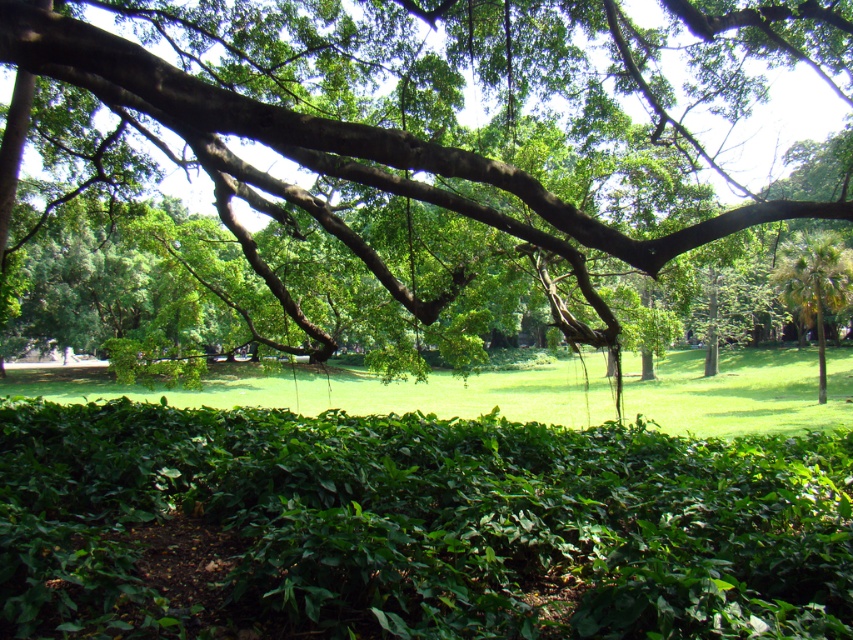
You are a gardener who needs to place a small statue between the green leafy bush at center and the green leafy palm at right. Which side of the statue should face the larger plant to ensure it gets more sunlight?

The green leafy bush at center is bigger than the green leafy palm at right, so the statue should be placed with its sunny side facing the green leafy palm at right to avoid shading from the larger bush.

You are standing in the park and want to place a small bench between the green leafy bush at center and the green leafy tree at upper center. Based on their positions, where should the bench be placed?

The green leafy bush at center is positioned under the green leafy tree at upper center, so the bench should be placed between them, below the tree and above the bush.